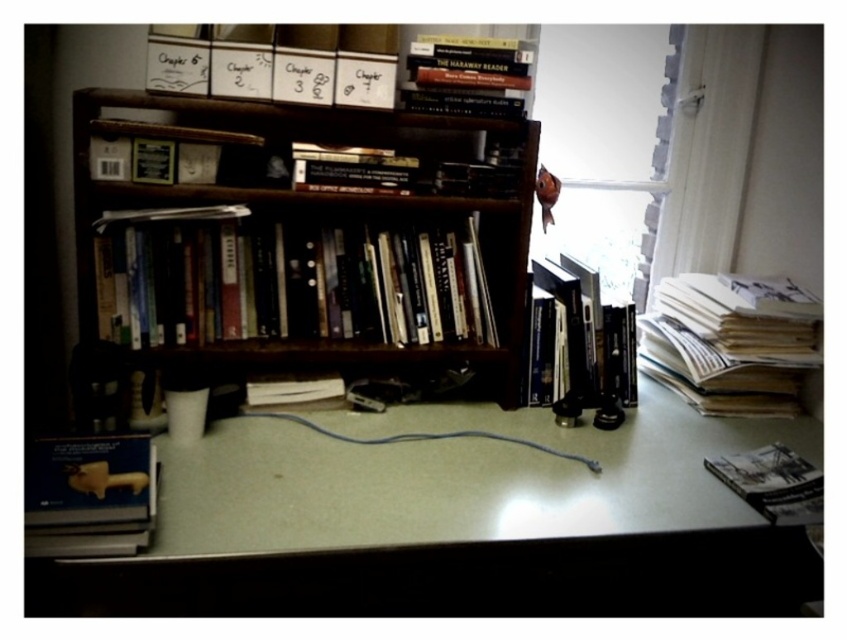
From the picture: Who is lower down, brown wooden bookshelf at center or hardcover books at right?

hardcover books at right

Locate an element on the screen. Image resolution: width=847 pixels, height=640 pixels. brown wooden bookshelf at center is located at coordinates (320, 220).

Locate an element on the screen. brown wooden bookshelf at center is located at coordinates (320, 220).

Between point (288, 252) and point (313, 184), which one is positioned in front?

Positioned in front is point (313, 184).

This screenshot has height=640, width=847. What do you see at coordinates (302, 282) in the screenshot?
I see `hardcover books at center` at bounding box center [302, 282].

Find the location of a particular element. This screenshot has height=640, width=847. hardcover books at center is located at coordinates (302, 282).

You are a GUI agent. You are given a task and a screenshot of the screen. Output one action in this format:
    pyautogui.click(x=<x>, y=<y>)
    Task: Click on the brown wooden bookshelf at center
    This screenshot has height=640, width=847.
    Given the screenshot: What is the action you would take?
    pyautogui.click(x=320, y=220)

Can you confirm if brown wooden bookshelf at center is smaller than matte yellow book at lower left?

Incorrect, brown wooden bookshelf at center is not smaller in size than matte yellow book at lower left.

Who is more forward, (x=292, y=220) or (x=131, y=496)?

Point (x=131, y=496)

The height and width of the screenshot is (640, 847). In order to click on brown wooden bookshelf at center in this screenshot , I will do `click(320, 220)`.